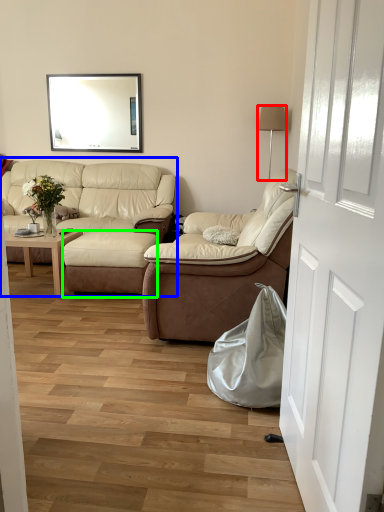
Question: Estimate the real-world distances between objects in this image. Which object is farther from lamp (highlighted by a red box), studio couch (highlighted by a blue box) or footrest (highlighted by a green box)?

Choices:
 (A) studio couch
 (B) footrest

Answer: (B)